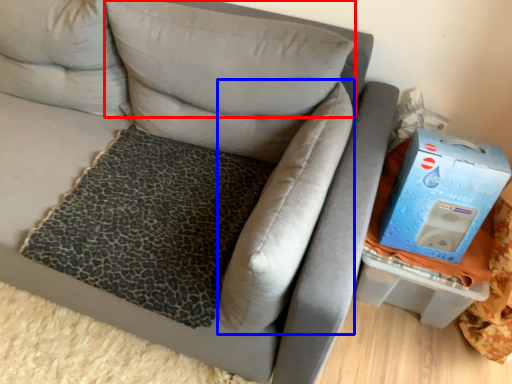
Question: Which point is further to the camera, pillow (highlighted by a red box) or pillow (highlighted by a blue box)?

Choices:
 (A) pillow
 (B) pillow

Answer: (A)